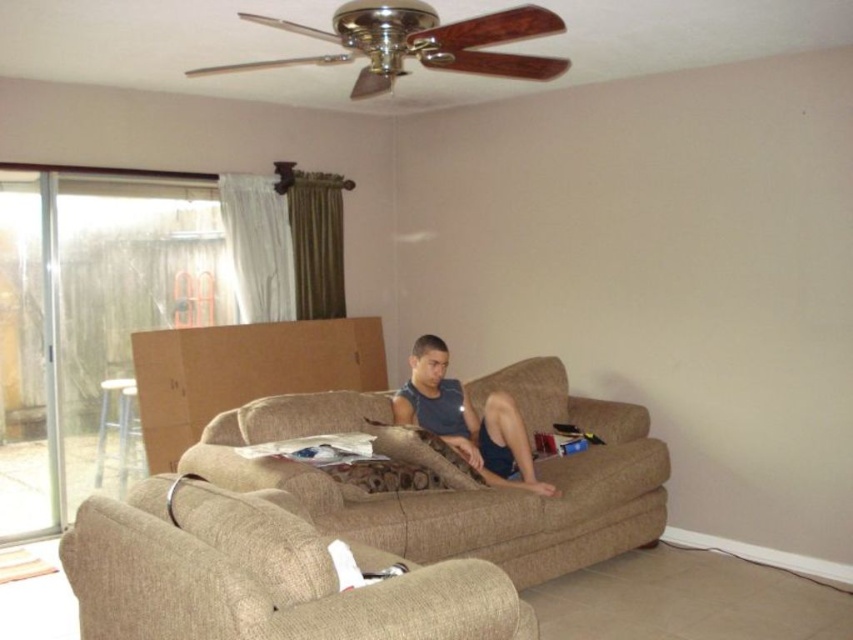
Question: Is transparent glass screen door at left bigger than matte blue tank top at center?

Choices:
 (A) yes
 (B) no

Answer: (B)

Question: Where is beige fabric armchair at lower left located in relation to transparent glass screen door at left in the image?

Choices:
 (A) below
 (B) above

Answer: (A)

Question: Can you confirm if transparent glass screen door at left is positioned below matte blue tank top at center?

Choices:
 (A) yes
 (B) no

Answer: (B)

Question: Which point is closer to the camera?

Choices:
 (A) (341, 512)
 (B) (10, 234)
 (C) (532, 481)

Answer: (A)

Question: Which point is farther to the camera?

Choices:
 (A) (4, 531)
 (B) (508, 401)

Answer: (A)

Question: Which point is farther to the camera?

Choices:
 (A) matte blue tank top at center
 (B) beige fabric armchair at lower left

Answer: (A)